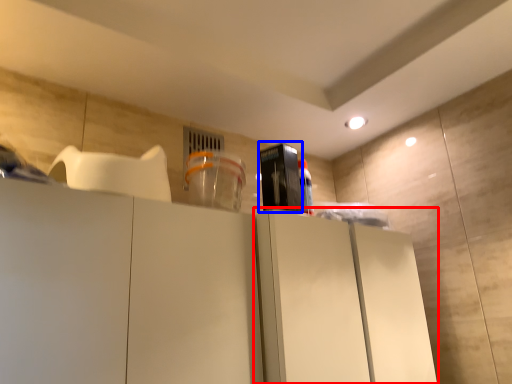
Question: Which point is further to the camera, cabinetry (highlighted by a red box) or appliance (highlighted by a blue box)?

Choices:
 (A) cabinetry
 (B) appliance

Answer: (B)